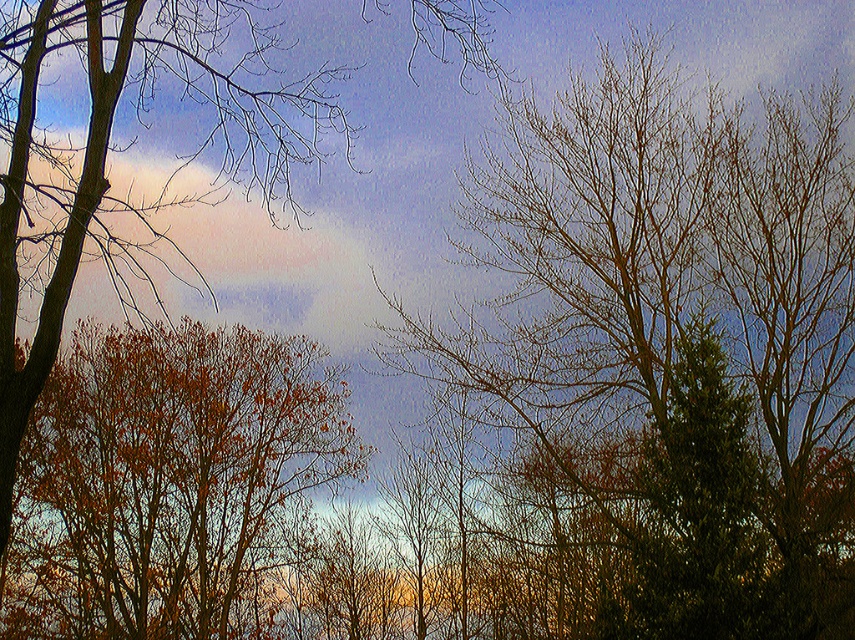
Measure the distance from bare branches at center to orange-brown foliage at center.

The distance of bare branches at center from orange-brown foliage at center is 10.13 meters.

Is bare branches at center wider than orange-brown foliage at center?

No.

The width and height of the screenshot is (855, 640). Identify the location of bare branches at center. [662, 358].

Based on the photo, between bare branches at center and brown leafy tree at left, which one is positioned lower?

Positioned lower is bare branches at center.

In the scene shown: Can you confirm if bare branches at center is positioned to the right of brown leafy tree at left?

Correct, you'll find bare branches at center to the right of brown leafy tree at left.

This screenshot has height=640, width=855. What are the coordinates of `bare branches at center` in the screenshot? It's located at (662, 358).

Which is below, orange-brown foliage at center or brown leafy tree at left?

orange-brown foliage at center is lower down.

Does orange-brown foliage at center come in front of brown leafy tree at left?

No, orange-brown foliage at center is behind brown leafy tree at left.

Locate an element on the screen. This screenshot has height=640, width=855. orange-brown foliage at center is located at coordinates (164, 477).